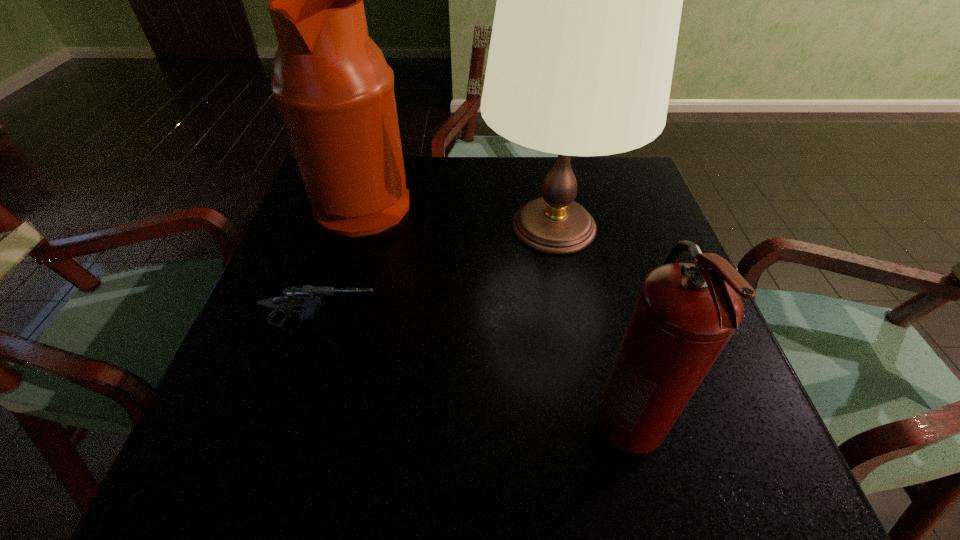
The height and width of the screenshot is (540, 960). In order to click on vacant point located between the lamp and the third farthest object in this screenshot , I will do `click(440, 276)`.

Image resolution: width=960 pixels, height=540 pixels. I want to click on vacant point located between the lamp and the water jug, so click(x=459, y=214).

You are a GUI agent. You are given a task and a screenshot of the screen. Output one action in this format:
    pyautogui.click(x=<x>, y=<y>)
    Task: Click on the free space between the second nearest object and the fire extinguisher
    
    Given the screenshot: What is the action you would take?
    (476, 375)

Where is `free space between the water jug and the lamp`? The width and height of the screenshot is (960, 540). free space between the water jug and the lamp is located at coordinates (459, 214).

Select which object is the third closest to the shortest object. Please provide its 2D coordinates. Your answer should be formatted as a tuple, i.e. [(x, y)], where the tuple contains the x and y coordinates of a point satisfying the conditions above.

[(685, 314)]

Image resolution: width=960 pixels, height=540 pixels. Identify the location of object that is the second closest to the lamp. (309, 298).